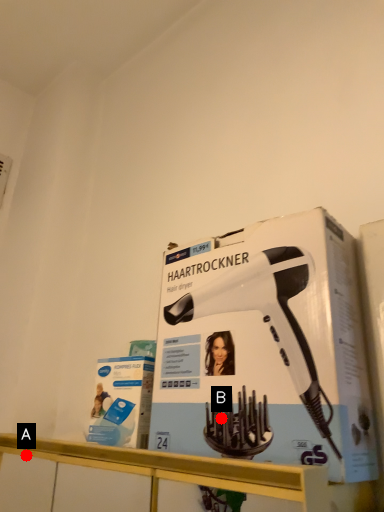
Question: Two points are circled on the image, labeled by A and B beside each circle. Which of the following is the farthest from the observer?

Choices:
 (A) A is further
 (B) B is further

Answer: (A)